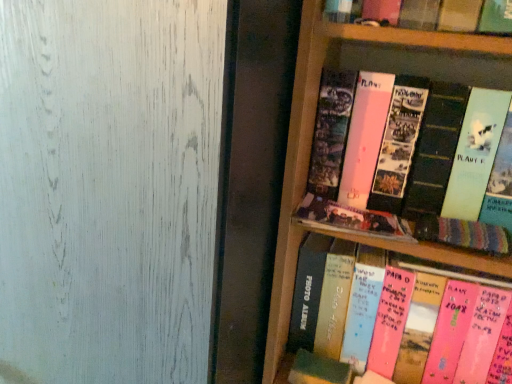
Question: Looking at the image, does pink matte photo album at upper right, acting as the 1th book starting from the top, seem bigger or smaller compared to knitted fabric book at right, which appears as the second book when ordered from the bottom?

Choices:
 (A) small
 (B) big

Answer: (B)

Question: From a real-world perspective, relative to knitted fabric book at right, which is the third book in top-to-bottom order, is pink matte photo album at upper right, acting as the 1th book starting from the top, vertically above or below?

Choices:
 (A) above
 (B) below

Answer: (A)

Question: Based on their relative distances, which object is nearer to the pink paper photo album at center, which ranks as the fourth book in top-to-bottom order?

Choices:
 (A) matte black photo album at center, marked as the third book in a bottom-to-top arrangement
 (B) pink matte photo album at upper right, acting as the 1th book starting from the top
 (C) transparent frosted glass at upper left
 (D) knitted fabric book at right, which appears as the second book when ordered from the bottom

Answer: (A)

Question: Which object is the closest to the pink matte photo album at upper right, acting as the 1th book starting from the top?

Choices:
 (A) knitted fabric book at right, which is the third book in top-to-bottom order
 (B) transparent frosted glass at upper left
 (C) pink paper photo album at center, which ranks as the fourth book in top-to-bottom order
 (D) matte black photo album at center, marked as the third book in a bottom-to-top arrangement

Answer: (D)